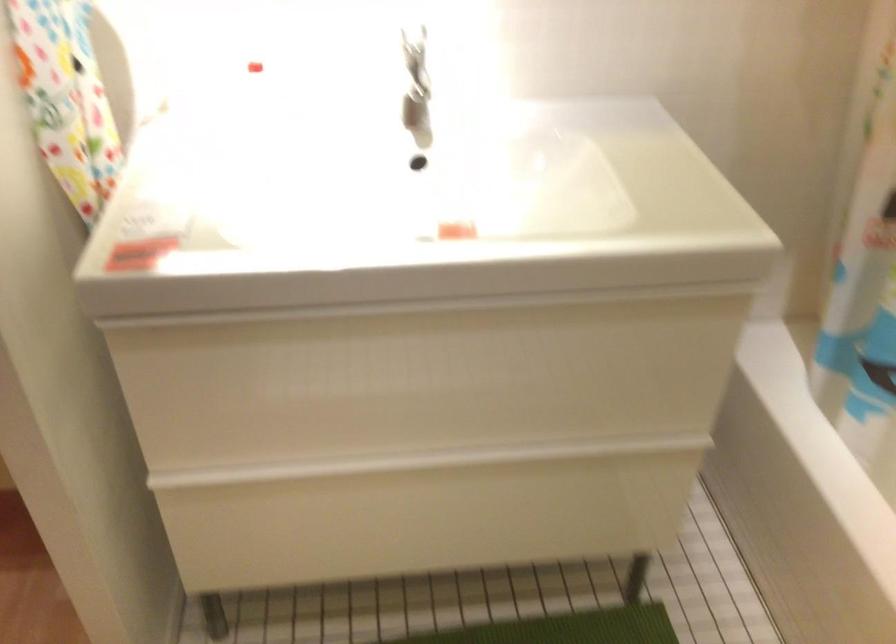
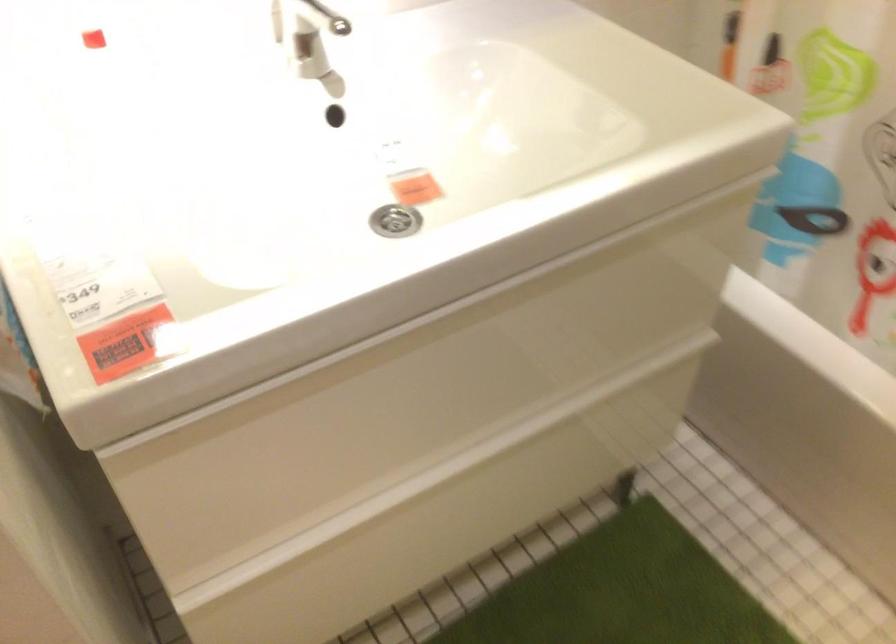
Locate, in the second image, the point that corresponds to point 398,506 in the first image.

(442, 514)